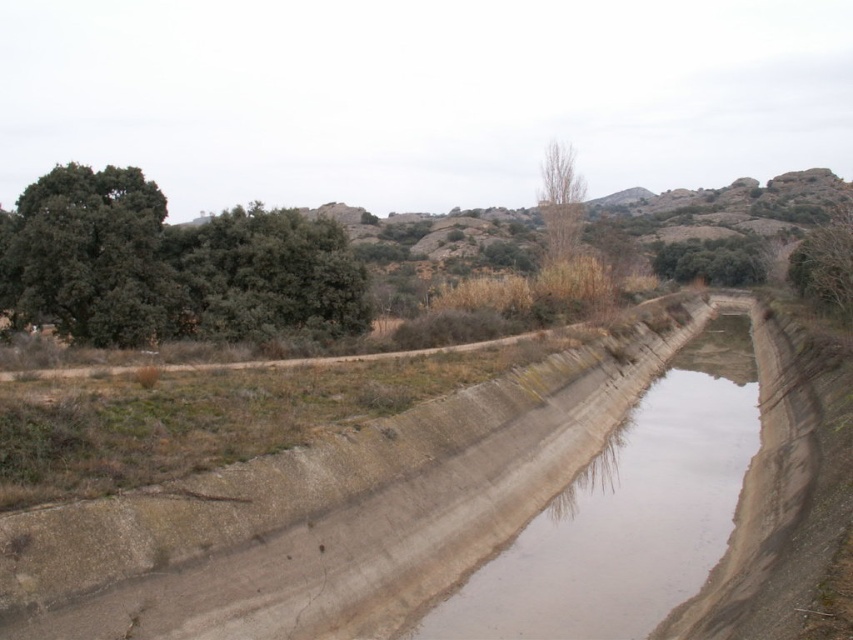
Question: Is green leafy tree at upper center to the right of bare wood tree at center from the viewer's perspective?

Choices:
 (A) no
 (B) yes

Answer: (B)

Question: Which of the following is the closest to the observer?

Choices:
 (A) green leafy tree at left
 (B) green leafy tree at upper right
 (C) bare wood tree at center

Answer: (A)

Question: Among these points, which one is nearest to the camera?

Choices:
 (A) (167, 296)
 (B) (202, 282)

Answer: (A)

Question: Is green leafy tree at upper center thinner than bare wood tree at center?

Choices:
 (A) no
 (B) yes

Answer: (B)

Question: Which of these objects is positioned farthest from the green leafy tree at upper left?

Choices:
 (A) bare wood tree at center
 (B) green leafy tree at upper right
 (C) green leafy tree at upper center

Answer: (C)

Question: Does green matte tree at upper left appear over green leafy tree at left?

Choices:
 (A) no
 (B) yes

Answer: (B)